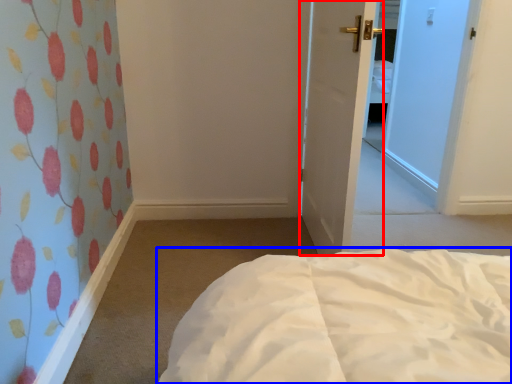
Question: Which point is closer to the camera, door (highlighted by a red box) or bed (highlighted by a blue box)?

Choices:
 (A) door
 (B) bed

Answer: (B)